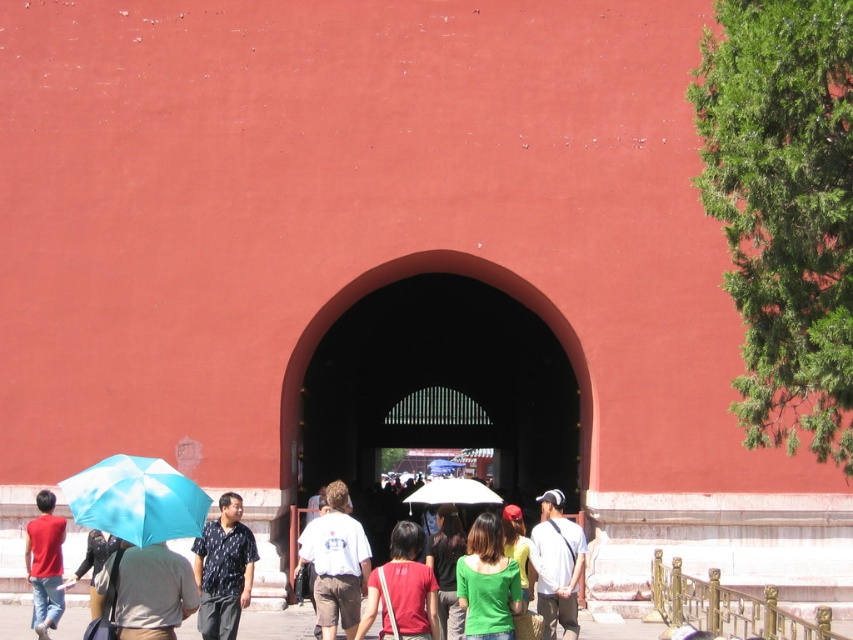
Can you confirm if blue matte umbrella at lower left is thinner than light brown fabric umbrella at lower left?

In fact, blue matte umbrella at lower left might be wider than light brown fabric umbrella at lower left.

Who is positioned more to the right, blue matte umbrella at lower left or light brown fabric umbrella at lower left?

light brown fabric umbrella at lower left is more to the right.

This screenshot has height=640, width=853. What are the coordinates of `blue matte umbrella at lower left` in the screenshot? It's located at (136, 499).

Is point (492, 264) less distant than point (502, 609)?

That is False.

Locate an element on the screen. dark red stone archway at center is located at coordinates (410, 275).

Who is lower down, green matte shirt at center or matte blue umbrella at lower left?

matte blue umbrella at lower left is below.

Can you confirm if green matte shirt at center is taller than matte blue umbrella at lower left?

In fact, green matte shirt at center may be shorter than matte blue umbrella at lower left.

Identify the location of green matte shirt at center. (486, 582).